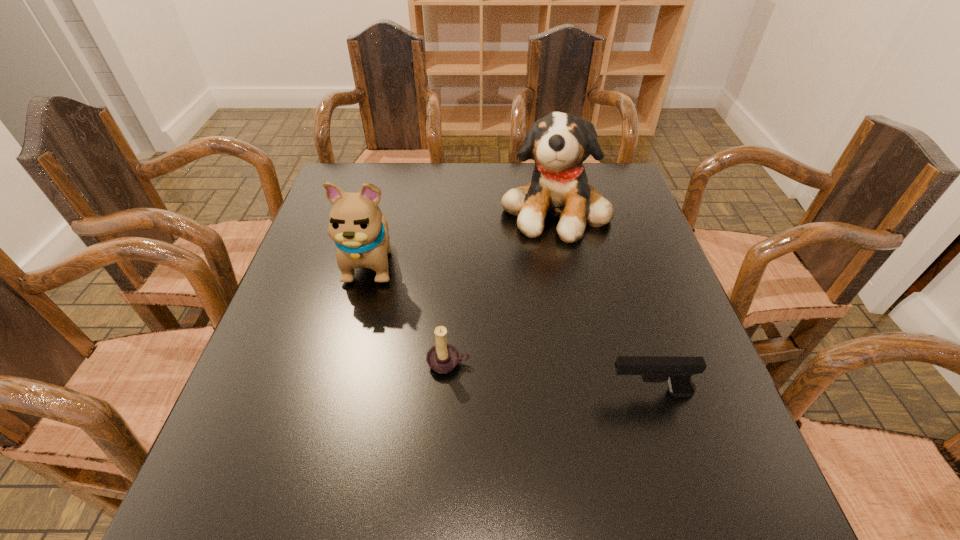
In the image, there is a desktop. Identify the location of free space at the far left corner. (360, 162).

What are the coordinates of `vacant space at the far right corner` in the screenshot? It's located at (603, 165).

Where is `unoccupied area between the leftmost object and the pistol`? unoccupied area between the leftmost object and the pistol is located at coordinates point(511,327).

At what (x,y) coordinates should I click in order to perform the action: click on free area in between the second nearest object and the leftmost object. Please return your answer as a coordinate pair (x, y). Image resolution: width=960 pixels, height=540 pixels. Looking at the image, I should click on (410, 312).

Where is `free space between the right puppy and the third object from right to left`? Image resolution: width=960 pixels, height=540 pixels. free space between the right puppy and the third object from right to left is located at coordinates (501, 286).

The height and width of the screenshot is (540, 960). I want to click on empty space that is in between the right puppy and the pistol, so click(602, 301).

I want to click on empty space between the pistol and the right puppy, so click(602, 301).

Locate an element on the screen. free point between the candle holder and the pistol is located at coordinates (549, 377).

What are the coordinates of `free space between the leftmost object and the pistol` in the screenshot? It's located at (511, 327).

The height and width of the screenshot is (540, 960). Identify the location of free point between the candle holder and the left puppy. (410, 312).